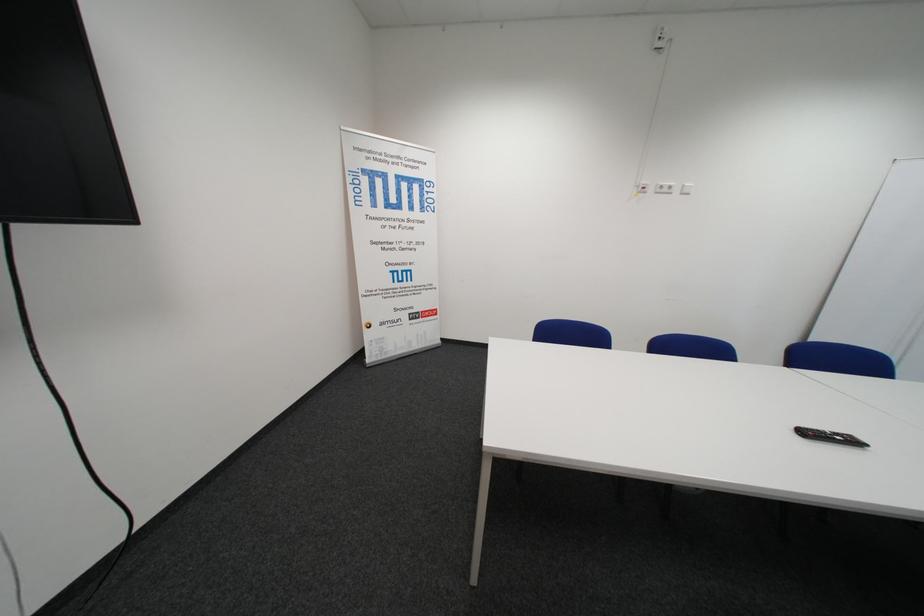
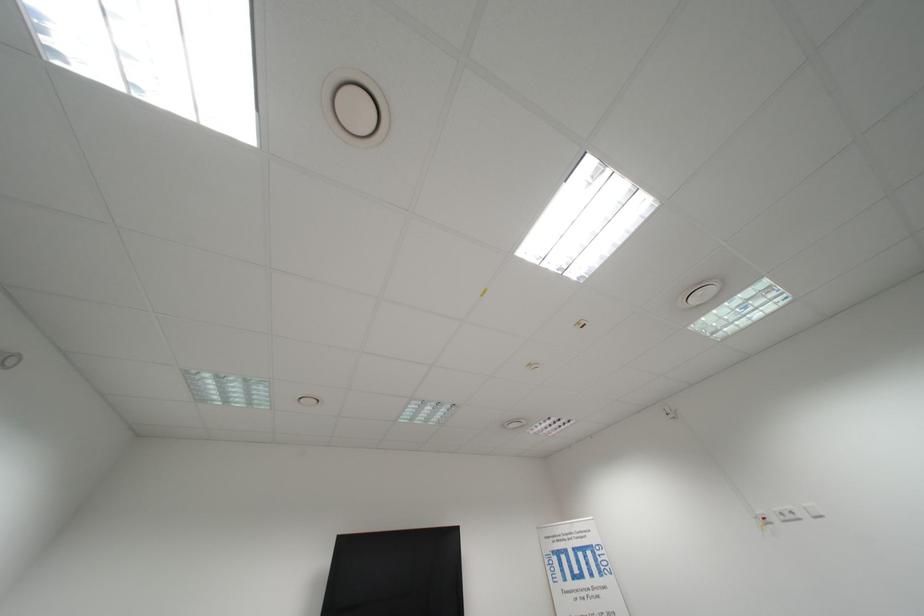
The point at (696, 187) is marked in the first image. Where is the corresponding point in the second image?

(818, 509)